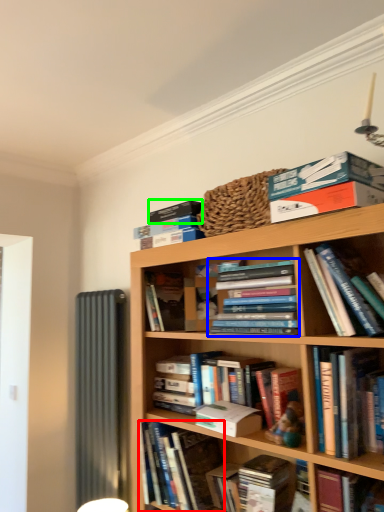
Question: Estimate the real-world distances between objects in this image. Which object is closer to book (highlighted by a red box), book (highlighted by a blue box) or paperback book (highlighted by a green box)?

Choices:
 (A) book
 (B) paperback book

Answer: (A)